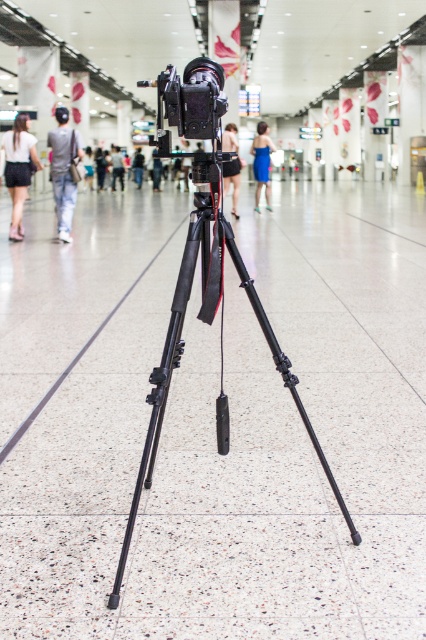
Question: Does black matte tripod at center have a smaller size compared to black matte shorts at center?

Choices:
 (A) no
 (B) yes

Answer: (B)

Question: Where is black matte shorts at center located in relation to matte black camera at center in the image?

Choices:
 (A) right
 (B) left

Answer: (A)

Question: Considering the real-world distances, which object is farthest from the denim pants at left?

Choices:
 (A) blue satin dress at center
 (B) black matte tripod at center
 (C) black fabric person at center

Answer: (C)

Question: Which of the following is the closest to the observer?

Choices:
 (A) (55, 195)
 (B) (233, 148)
 (C) (112, 188)
 (D) (31, 145)

Answer: (A)

Question: Observing the image, what is the correct spatial positioning of black matte tripod at center in reference to blue satin dress at center?

Choices:
 (A) above
 (B) below

Answer: (B)

Question: Which object appears farthest from the camera in this image?

Choices:
 (A) matte black shorts at left
 (B) denim pants at left
 (C) black matte video camera at center
 (D) blue satin dress at center

Answer: (D)